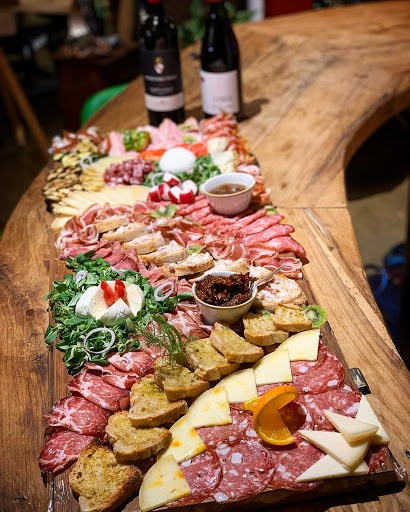
The width and height of the screenshot is (410, 512). In order to click on bottle of wine in this screenshot , I will do `click(220, 31)`, `click(225, 91)`, `click(166, 98)`, `click(161, 63)`, `click(162, 33)`.